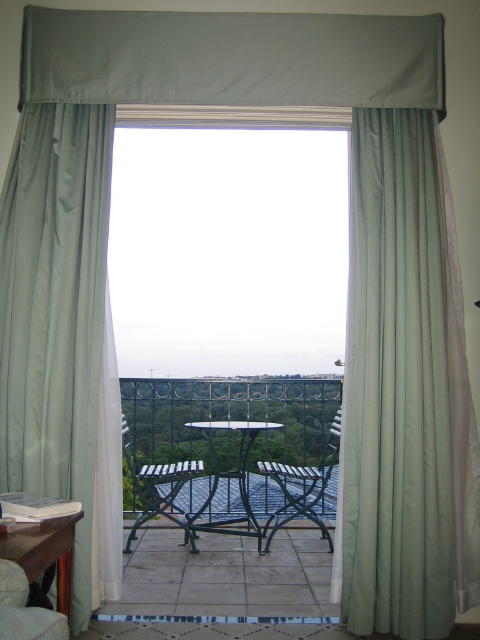
You are standing on the balcony and want to sit in the velvet beige armchair at lower left. However, the satin fabric curtain at right is blocking your path. Can you move the curtain to access the chair?

The satin fabric curtain at right is positioned over the velvet beige armchair at lower left, so you can move the curtain to access the chair.

You are a delivery person trying to place a large package that measures 10 inches in width between the metallic blue armchair at center and the metallic wrought iron table at center on the balcony. Can the package fit between them without moving either object?

The metallic blue armchair at center and the metallic wrought iron table at center are 9.50 inches apart. Since the package is 10 inches wide, it cannot fit between them as the space is narrower than the package.

You are a delivery robot with a package that needs to be placed between the satin green curtain at left and the metallic green armchair at center. The package is 1.2 meters long. Will it fit in the space between them?

The distance between the satin green curtain at left and the metallic green armchair at center is 1.26 meters. Since the package is 1.2 meters long, it will fit with 0.06 meters of space remaining.